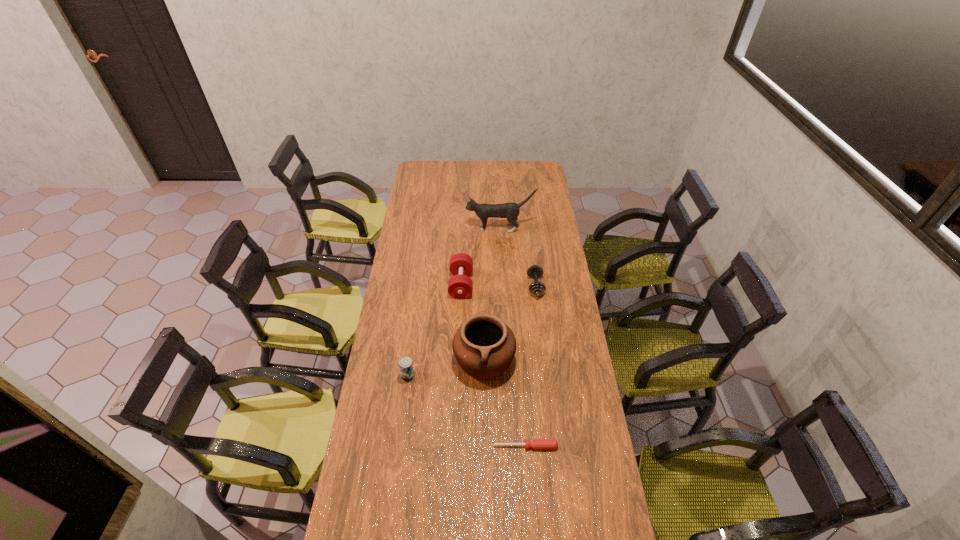
Find the location of a particular element. The height and width of the screenshot is (540, 960). cat is located at coordinates (510, 210).

The width and height of the screenshot is (960, 540). I want to click on the tallest object, so click(510, 210).

Locate an element on the screen. pottery is located at coordinates (484, 346).

Image resolution: width=960 pixels, height=540 pixels. Identify the location of the left dumbbell. (460, 286).

At what (x,y) coordinates should I click in order to perform the action: click on beer can. Please return your answer as a coordinate pair (x, y). Image resolution: width=960 pixels, height=540 pixels. Looking at the image, I should click on (405, 363).

At what (x,y) coordinates should I click in order to perform the action: click on the right dumbbell. Please return your answer as a coordinate pair (x, y). Looking at the image, I should click on (536, 288).

Image resolution: width=960 pixels, height=540 pixels. I want to click on the shorter dumbbell, so click(536, 288).

Find the location of a particular element. the shortest object is located at coordinates (535, 443).

Identify the location of screwdriver. The image size is (960, 540). (535, 443).

What are the coordinates of `vacant area located 0.050m at the face of the cat` in the screenshot? It's located at (457, 228).